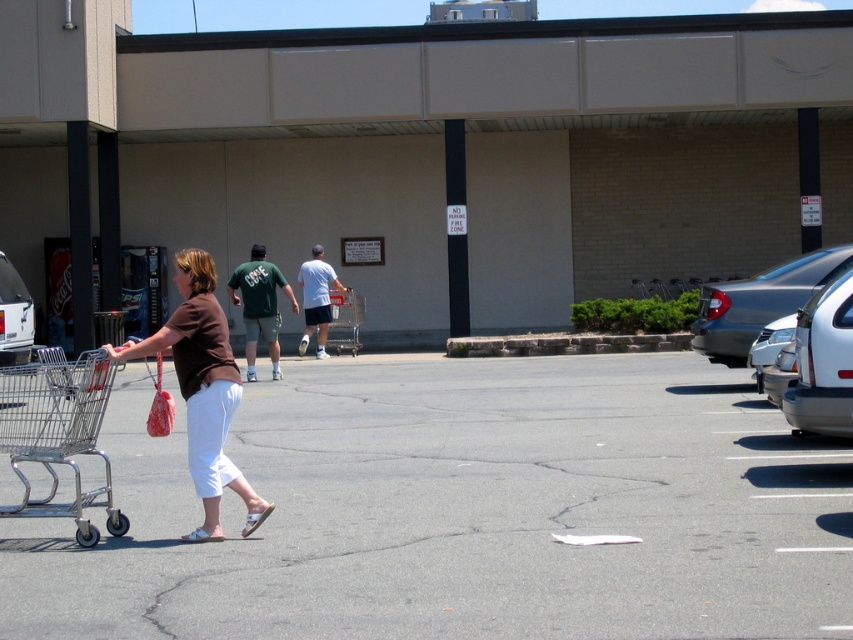
Question: Is the position of metallic silver shopping cart at lower left more distant than that of green fabric shirt at center?

Choices:
 (A) no
 (B) yes

Answer: (A)

Question: Which object is positioned closest to the white glossy car at center?

Choices:
 (A) metallic silver shopping cart at lower left
 (B) brown fabric shirt at center
 (C) green fabric shirt at center

Answer: (C)

Question: Is silver metallic suv at right below white cotton t-shirt at center?

Choices:
 (A) yes
 (B) no

Answer: (A)

Question: Is silver metallic shopping cart at left wider than silver metallic suv at right?

Choices:
 (A) no
 (B) yes

Answer: (A)

Question: Estimate the real-world distances between objects in this image. Which object is farther from the silver metallic shopping cart at left?

Choices:
 (A) metallic silver shopping cart at lower left
 (B) silver metallic sedan at right

Answer: (B)

Question: Which of the following is the farthest from the observer?

Choices:
 (A) silver metallic sedan at right
 (B) silver metallic shopping cart at left
 (C) silver metallic suv at right
 (D) white cotton t-shirt at center

Answer: (D)